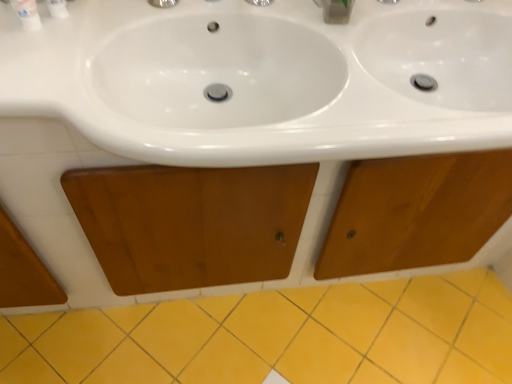
Find the location of a particular element. Image resolution: width=512 pixels, height=384 pixels. vacant space to the right of white glossy bottle at upper left is located at coordinates (106, 41).